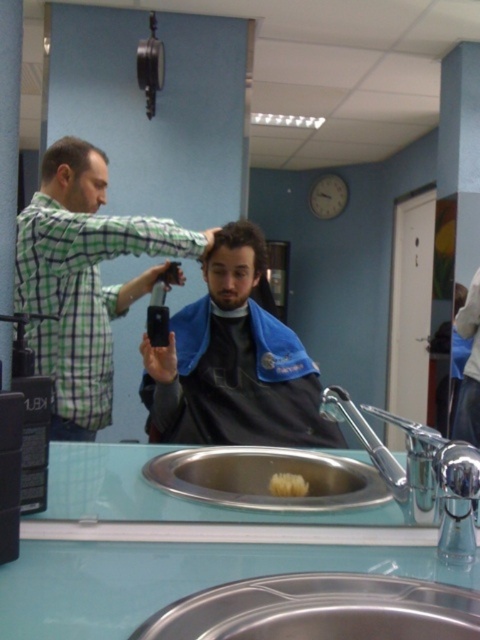
You are a customer in the barbershop and you want to wash your hands. The chrome metallic faucet at sink right and the dark blue fabric at center are both in your view. Which object should you approach first to turn on the water?

You should approach the chrome metallic faucet at sink right first because it is positioned on the left side of the dark blue fabric at center, making it closer to your current position if you are facing the sink.

You are a customer in the barbershop and want to wash your hair. The chrome metallic faucet at sink right and the dark brown hair at center are both in your view. Which object is closer to you?

The chrome metallic faucet at sink right is closer to you because it is in front of the dark brown hair at center.

You are a customer in the barbershop and need to choose between placing your keys on the chrome metallic faucet at sink right or the dark blue fabric at center. Which surface can accommodate the keys without them hanging off the edge?

The chrome metallic faucet at sink right has a larger width than the dark blue fabric at center, so placing the keys there would prevent them from hanging off the edge.